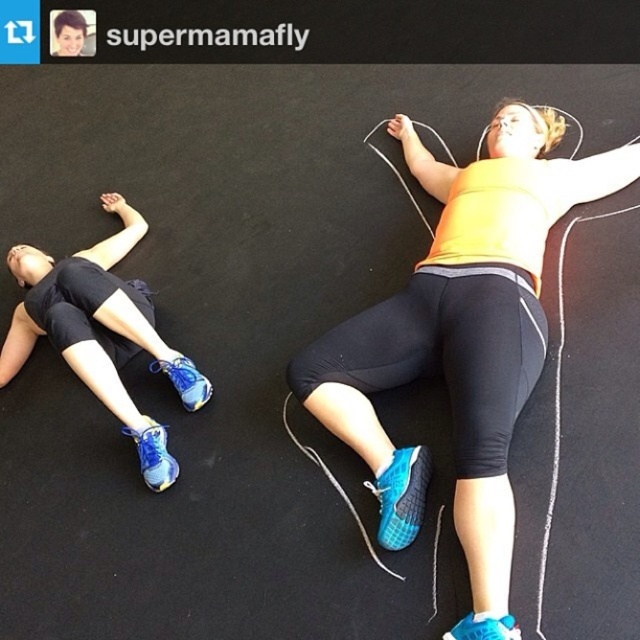
Question: Which object is closer to the camera taking this photo?

Choices:
 (A) yellow matte tank top at center
 (B) matte blue athletic shoe at upper left

Answer: (A)

Question: Which of the following is the farthest from the observer?

Choices:
 (A) (97, 387)
 (B) (353, 388)

Answer: (A)

Question: Is the position of yellow matte tank top at center more distant than that of matte blue athletic shoe at upper left?

Choices:
 (A) yes
 (B) no

Answer: (B)

Question: Is yellow matte tank top at center bigger than matte blue athletic shoe at upper left?

Choices:
 (A) yes
 (B) no

Answer: (A)

Question: Is yellow matte tank top at center to the left of matte blue athletic shoe at upper left from the viewer's perspective?

Choices:
 (A) yes
 (B) no

Answer: (B)